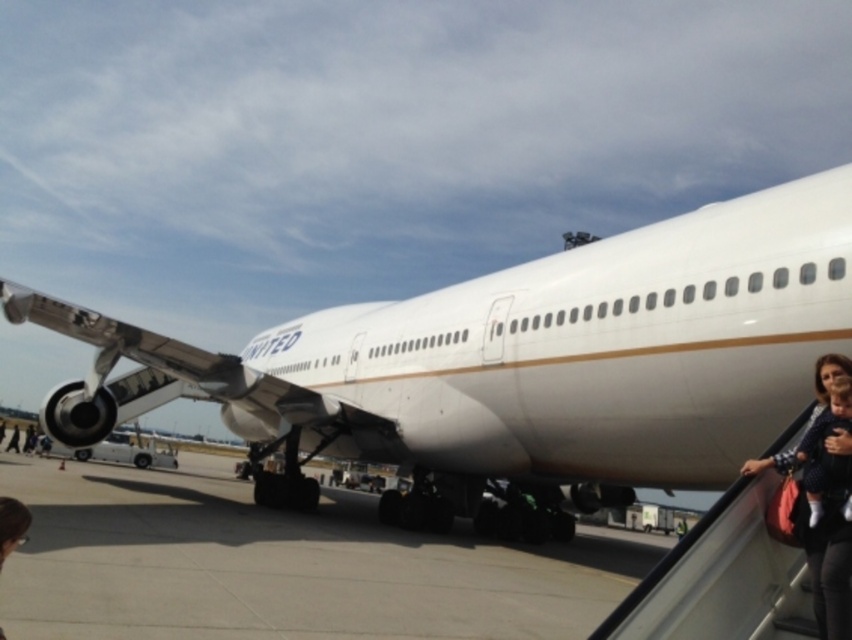
You are standing at the airport gate and see two points marked on the image. The first point is at coordinates point (x=692, y=387) and the second point is at point (x=0, y=516). Which point is closer to your current position?

Point (x=692, y=387) is closer to your current position because it is further to the viewer than point (x=0, y=516).

You are a photographer standing at the airport gate. You want to take a photo of the white glossy airplane at center and the matte black dress at lower right. Which object will appear larger in your photo?

The white glossy airplane at center will appear larger in the photo because it is much taller than the matte black dress at lower right.